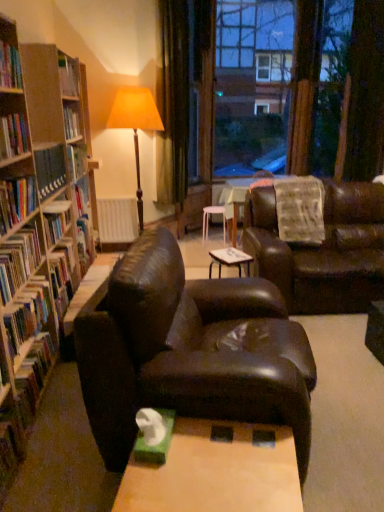
Question: Should I look upward or downward to see hardcover book at left, the sixth book when ordered from bottom to top?

Choices:
 (A) down
 (B) up

Answer: (B)

Question: Is green velvet curtain at upper center placed right next to green matte tissue box at lower center?

Choices:
 (A) yes
 (B) no

Answer: (B)

Question: Can you confirm if green velvet curtain at upper center is positioned to the left of green matte tissue box at lower center?

Choices:
 (A) yes
 (B) no

Answer: (A)

Question: Is green velvet curtain at upper center aimed at green matte tissue box at lower center?

Choices:
 (A) no
 (B) yes

Answer: (A)

Question: From the image's perspective, would you say green velvet curtain at upper center is positioned over green matte tissue box at lower center?

Choices:
 (A) no
 (B) yes

Answer: (B)

Question: Does green velvet curtain at upper center lie behind green matte tissue box at lower center?

Choices:
 (A) no
 (B) yes

Answer: (B)

Question: Does green velvet curtain at upper center contain green matte tissue box at lower center?

Choices:
 (A) no
 (B) yes

Answer: (A)

Question: From the image's perspective, does green velvet curtain at upper center appear lower than hardcover book at left, the third book positioned from the bottom?

Choices:
 (A) no
 (B) yes

Answer: (A)

Question: Are green velvet curtain at upper center and hardcover book at left, which is counted as the fourth book, starting from the top, far apart?

Choices:
 (A) no
 (B) yes

Answer: (B)

Question: Is green velvet curtain at upper center positioned behind hardcover book at left, which is counted as the fourth book, starting from the top?

Choices:
 (A) no
 (B) yes

Answer: (B)

Question: Is green velvet curtain at upper center facing away from hardcover book at left, which is counted as the fourth book, starting from the top?

Choices:
 (A) no
 (B) yes

Answer: (A)

Question: Considering the relative sizes of green velvet curtain at upper center and hardcover book at left, which is counted as the fourth book, starting from the top, in the image provided, is green velvet curtain at upper center wider than hardcover book at left, which is counted as the fourth book, starting from the top,?

Choices:
 (A) no
 (B) yes

Answer: (A)

Question: Would you say hardcover book at left, the third book positioned from the bottom, is part of green velvet curtain at upper center's contents?

Choices:
 (A) no
 (B) yes

Answer: (A)

Question: Considering the relative sizes of transparent glass window at center and hardcover book at left, acting as the 1th book starting from the top, in the image provided, is transparent glass window at center wider than hardcover book at left, acting as the 1th book starting from the top,?

Choices:
 (A) yes
 (B) no

Answer: (A)